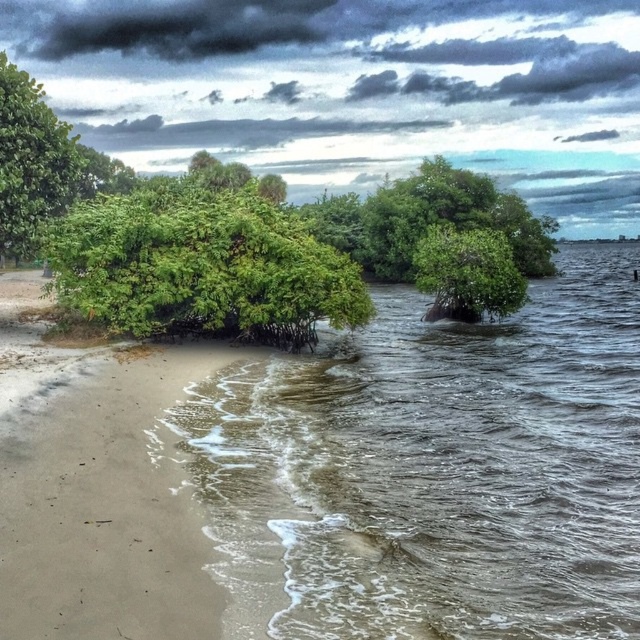
Who is positioned more to the left, brown murky water at center or green leafy tree at left?

green leafy tree at left

Which is behind, point (451, 513) or point (44, 205)?

The point (44, 205) is more distant.

The width and height of the screenshot is (640, 640). I want to click on brown murky water at center, so click(467, 467).

Does green leafy bush at left come in front of green leafy tree at left?

No.

Can you confirm if green leafy bush at left is taller than green leafy tree at left?

Yes.

Between point (259, 262) and point (61, 186), which one is positioned in front?

Point (61, 186) is in front.

You are a GUI agent. You are given a task and a screenshot of the screen. Output one action in this format:
    pyautogui.click(x=<x>, y=<y>)
    Task: Click on the green leafy bush at left
    
    Given the screenshot: What is the action you would take?
    pyautogui.click(x=202, y=266)

From the picture: How far apart are green leafy bush at left and green leafy tree at center?

A distance of 7.73 meters exists between green leafy bush at left and green leafy tree at center.

At what (x,y) coordinates should I click in order to perform the action: click on green leafy bush at left. Please return your answer as a coordinate pair (x, y). The width and height of the screenshot is (640, 640). Looking at the image, I should click on (202, 266).

Locate an element on the screen. The height and width of the screenshot is (640, 640). green leafy bush at left is located at coordinates (202, 266).